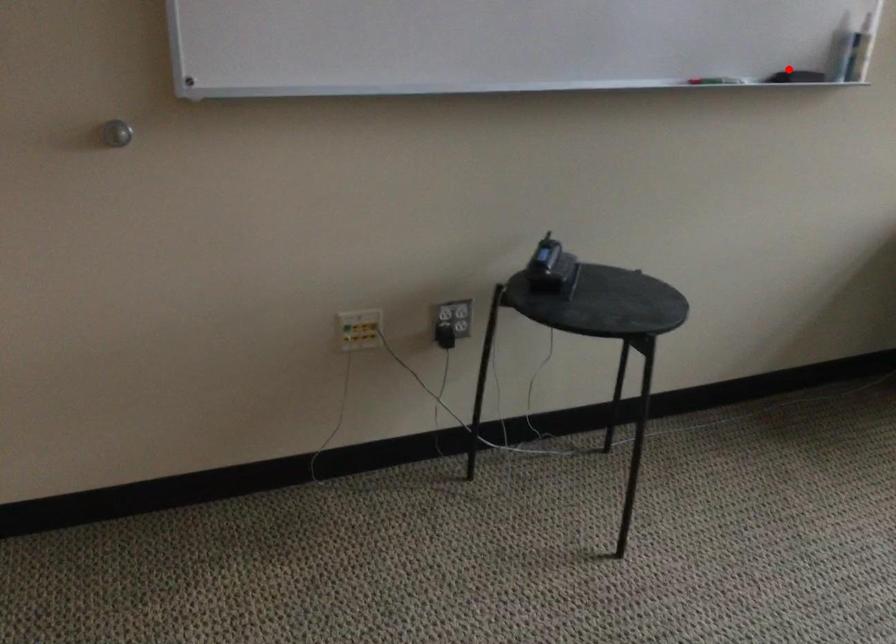
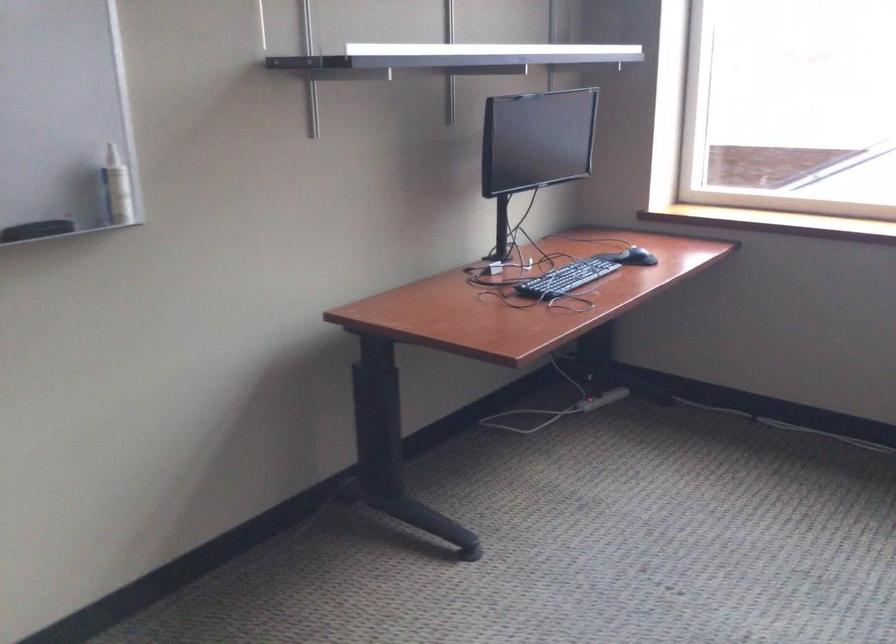
Question: I am providing you with two images of the same scene from different viewpoints. A red point is marked on the first image. At the location where the point appears in image 1, is it still visible in image 2?

Choices:
 (A) Yes
 (B) No

Answer: (A)